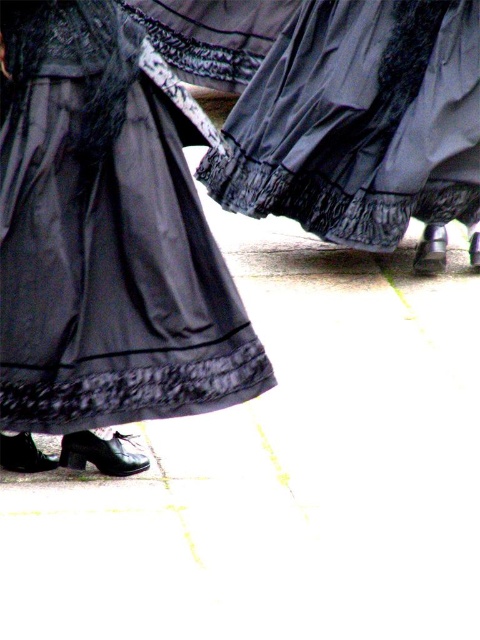
Does satin black dress at lower left appear over matte black skirt at center?

No.

Who is more distant from viewer, (x=137, y=317) or (x=346, y=211)?

The point (x=346, y=211) is behind.

You are a GUI agent. You are given a task and a screenshot of the screen. Output one action in this format:
    pyautogui.click(x=<x>, y=<y>)
    Task: Click on the satin black dress at lower left
    The image size is (480, 640).
    Given the screenshot: What is the action you would take?
    pos(108,234)